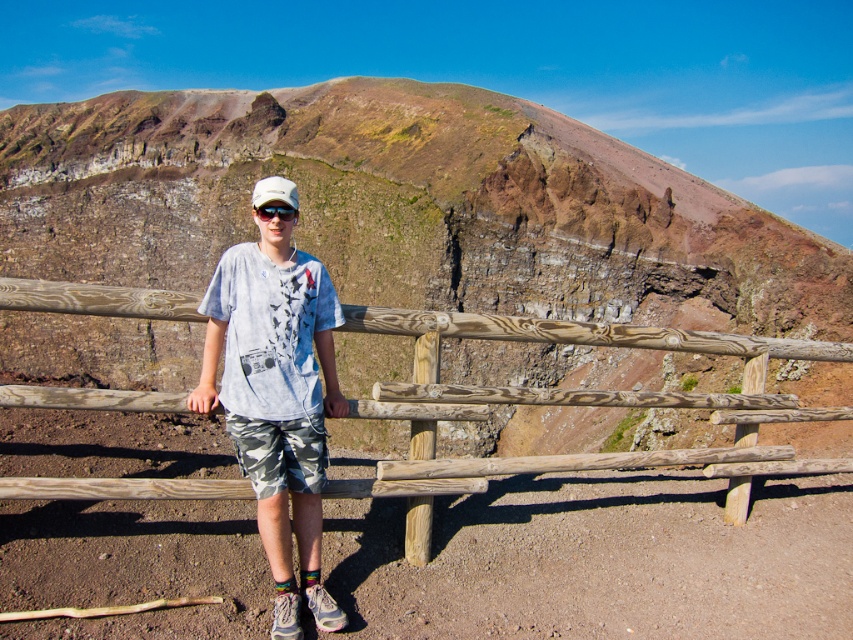
Is brown rocky mountain at center taller than white cotton shirt at center?

Yes, brown rocky mountain at center is taller than white cotton shirt at center.

Which is below, brown rocky mountain at center or white cotton shirt at center?

white cotton shirt at center is below.

Based on the photo, who is more forward, [178,221] or [281,344]?

Point [281,344]

Locate an element on the screen. The image size is (853, 640). brown rocky mountain at center is located at coordinates (399, 204).

Which is in front, point (97, 141) or point (292, 218)?

Positioned in front is point (292, 218).

Is brown rocky mountain at center smaller than black plastic goggles at center?

No, brown rocky mountain at center is not smaller than black plastic goggles at center.

Does point (503, 301) come farther from viewer compared to point (282, 209)?

Yes, it is.

The width and height of the screenshot is (853, 640). Identify the location of brown rocky mountain at center. (399, 204).

Does white matte baseball hat at center have a smaller size compared to black plastic goggles at center?

No.

Between white matte baseball hat at center and black plastic goggles at center, which one appears on the right side from the viewer's perspective?

From the viewer's perspective, black plastic goggles at center appears more on the right side.

Does point (268, 184) come closer to viewer compared to point (294, 216)?

Yes, it is.

Identify the location of white matte baseball hat at center. (274, 192).